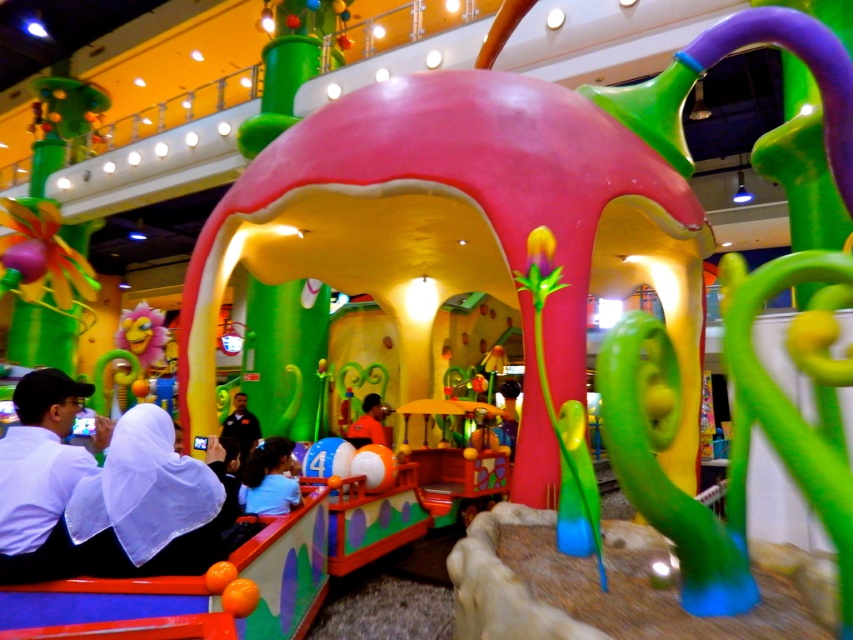
Question: Which of the following is the closest to the observer?

Choices:
 (A) orange matte shirt at center
 (B) white matte shirt at lower left
 (C) white matte shirt at center

Answer: (B)

Question: Among these objects, which one is farthest from the camera?

Choices:
 (A) white matte shirt at center
 (B) black matte shirt at center

Answer: (B)

Question: Can you confirm if white matte shirt at center is positioned below orange matte shirt at center?

Choices:
 (A) yes
 (B) no

Answer: (B)

Question: Can you confirm if white matte shirt at lower left is positioned below white matte shirt at center?

Choices:
 (A) no
 (B) yes

Answer: (A)

Question: Which of the following is the farthest from the observer?

Choices:
 (A) (28, 403)
 (B) (358, 433)
 (C) (241, 477)
 (D) (231, 412)

Answer: (D)

Question: Can you confirm if white matte shirt at lower left is positioned below white matte shirt at center?

Choices:
 (A) yes
 (B) no

Answer: (B)